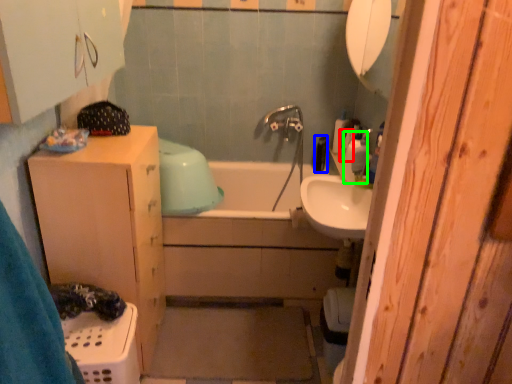
Question: Considering the real-world distances, which object is farthest from toiletry (highlighted by a red box)? toiletry (highlighted by a blue box) or soap dispenser (highlighted by a green box)?

Choices:
 (A) toiletry
 (B) soap dispenser

Answer: (A)